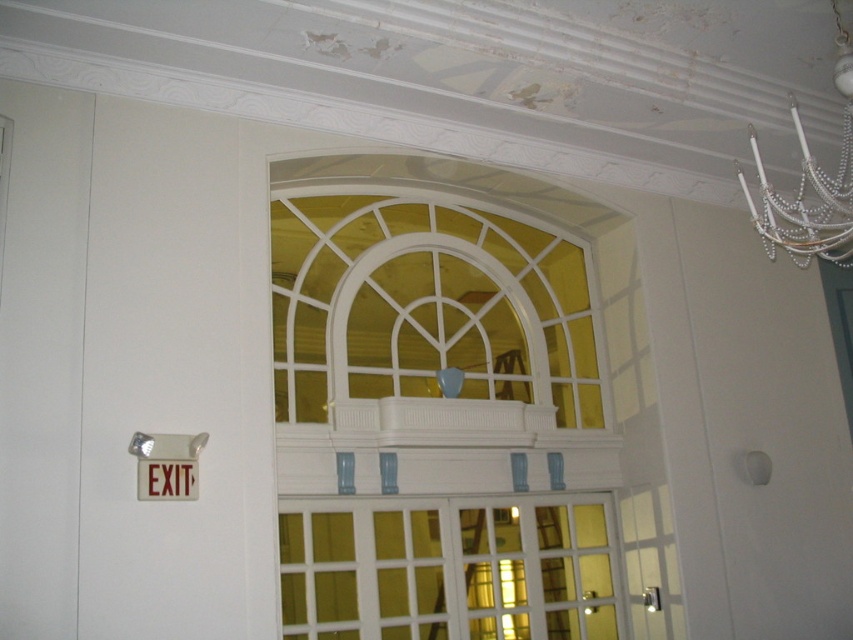
You are standing in the room and want to exit through the white glass door at center. The pearl white chandelier at upper right is directly above the door. Is the chandelier hanging above the door at a height that could potentially block your exit?

The white glass door at center has a lesser height compared to pearl white chandelier at upper right, so the chandelier is taller than the door. However, since the chandelier is at upper right and above the door, its height might not block the exit as it is positioned higher up and possibly out of the way.

You are in a room with a white glass door at center and a red plastic exit sign at upper left. Which object is larger?

The white glass door at center is bigger than the red plastic exit sign at upper left.